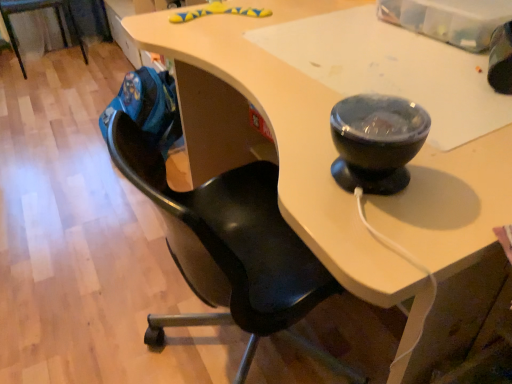
Locate an element on the screen. vacant space in black leather chair at left, which is counted as the 1th chair, starting from the back (from a real-world perspective) is located at coordinates (47, 63).